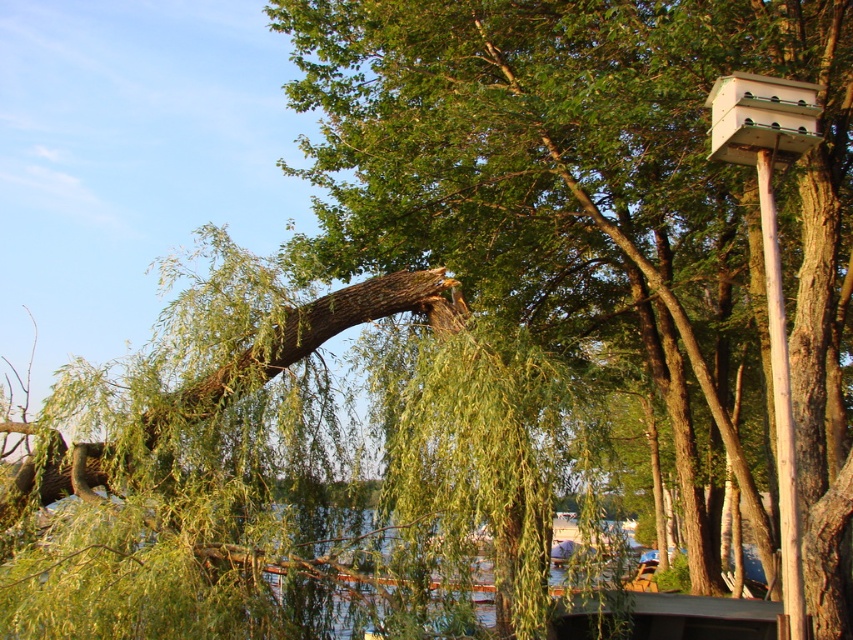
Question: Which point is closer to the camera taking this photo?

Choices:
 (A) (712, 141)
 (B) (508, 570)
 (C) (137, 570)

Answer: (C)

Question: In this image, where is green leafy willow at center located relative to white plastic bird feeder at upper right?

Choices:
 (A) left
 (B) right

Answer: (A)

Question: Which point is farther from the camera taking this photo?

Choices:
 (A) (248, 596)
 (B) (715, 113)

Answer: (B)

Question: Can you confirm if green leafy water at lower center is positioned to the right of white plastic bird feeder at upper right?

Choices:
 (A) no
 (B) yes

Answer: (A)

Question: Based on their relative distances, which object is nearer to the white plastic bird feeder at upper right?

Choices:
 (A) green leafy willow at center
 (B) green leafy water at lower center

Answer: (A)

Question: Does green leafy willow at center have a greater width compared to white plastic bird feeder at upper right?

Choices:
 (A) no
 (B) yes

Answer: (B)